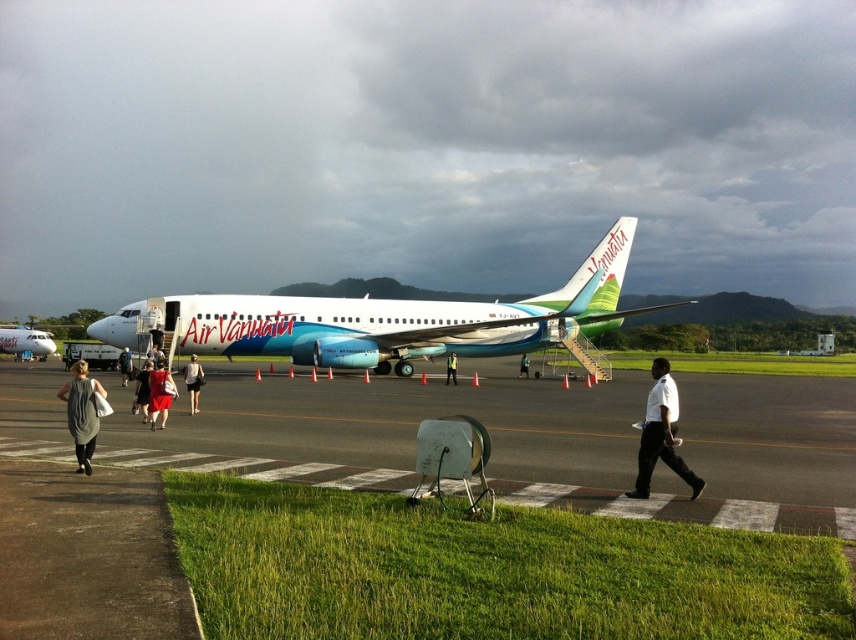
You are standing at the center of the airport tarmac and want to locate the white glossy airplane at center. According to the coordinates provided, where should you look relative to your position?

The white glossy airplane at center is located at coordinates point (382, 320), which is directly in front of you at the center of the scene.

You are a photographer at the airport. You want to take a photo of the white glossy airplane at center and the dark gray dress at center. Which object should you focus on first if you want to capture both in one shot without zooming in or out?

The white glossy airplane at center is larger in size than the dark gray dress at center, so you should focus on the airplane first to ensure it fills the frame appropriately before adjusting for the smaller dress.